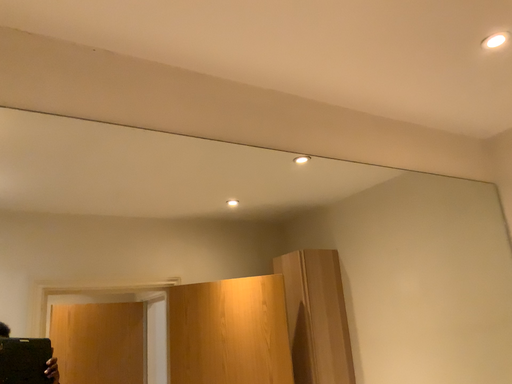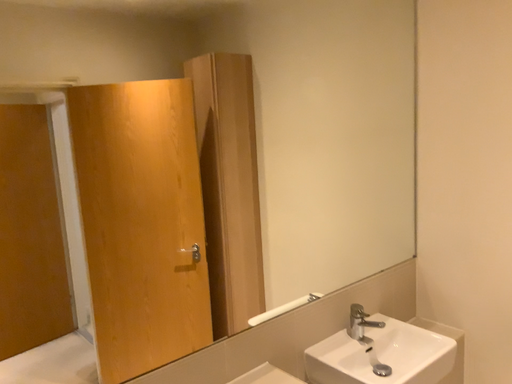
Question: How did the camera likely rotate when shooting the video?

Choices:
 (A) rotated upward
 (B) rotated downward

Answer: (B)